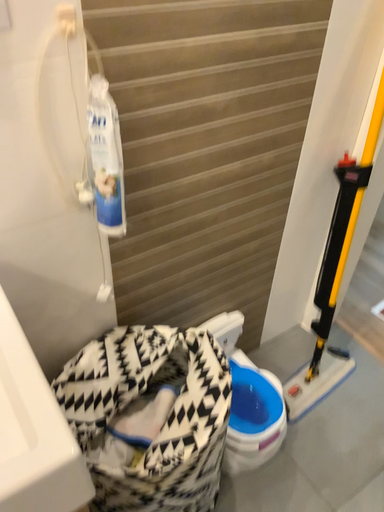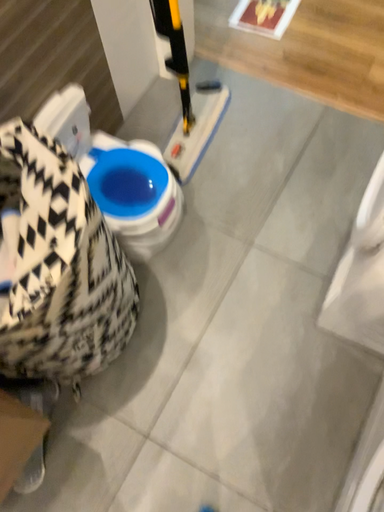
Question: How did the camera likely rotate when shooting the video?

Choices:
 (A) rotated downward
 (B) rotated upward

Answer: (A)